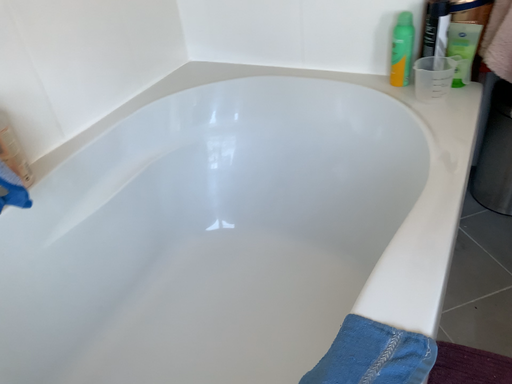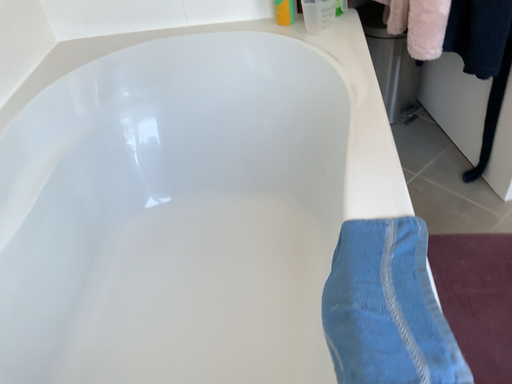
Question: Which way did the camera rotate in the video?

Choices:
 (A) rotated right
 (B) rotated left

Answer: (A)